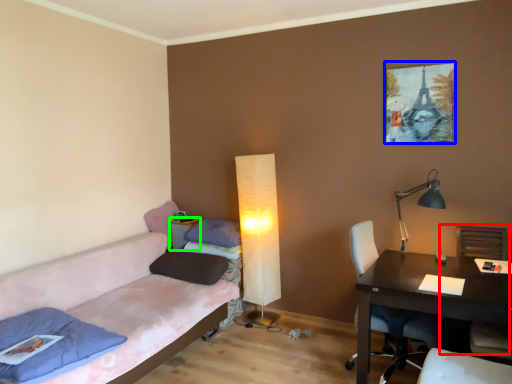
Question: Based on their relative distances, which object is farther from armchair (highlighted by a red box)? Choose from picture frame (highlighted by a blue box) and side table (highlighted by a green box).

Choices:
 (A) picture frame
 (B) side table

Answer: (B)